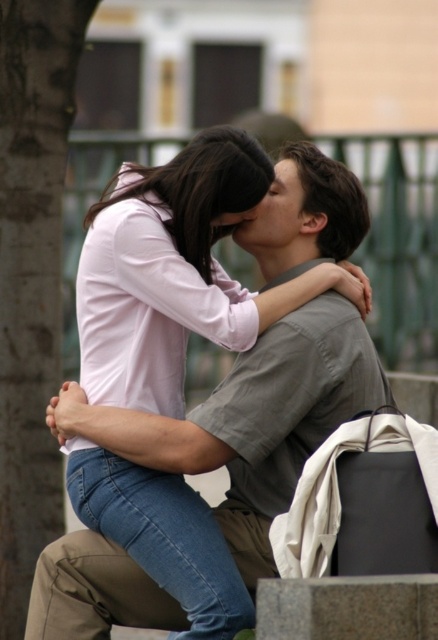
Question: Does matte pink shirt at center have a smaller size compared to brown rough tree trunk at left?

Choices:
 (A) yes
 (B) no

Answer: (B)

Question: Considering the relative positions of matte pink shirt at center and brown rough tree trunk at left in the image provided, where is matte pink shirt at center located with respect to brown rough tree trunk at left?

Choices:
 (A) above
 (B) below

Answer: (B)

Question: Does matte pink shirt at center have a smaller size compared to brown rough tree trunk at left?

Choices:
 (A) no
 (B) yes

Answer: (A)

Question: Which of the following is the farthest from the observer?

Choices:
 (A) (7, 381)
 (B) (306, 448)

Answer: (A)